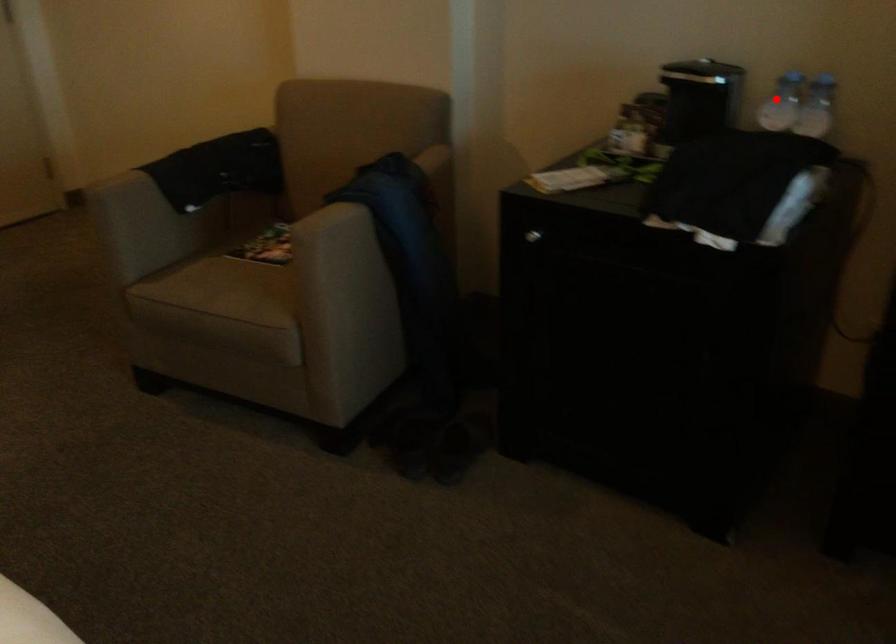
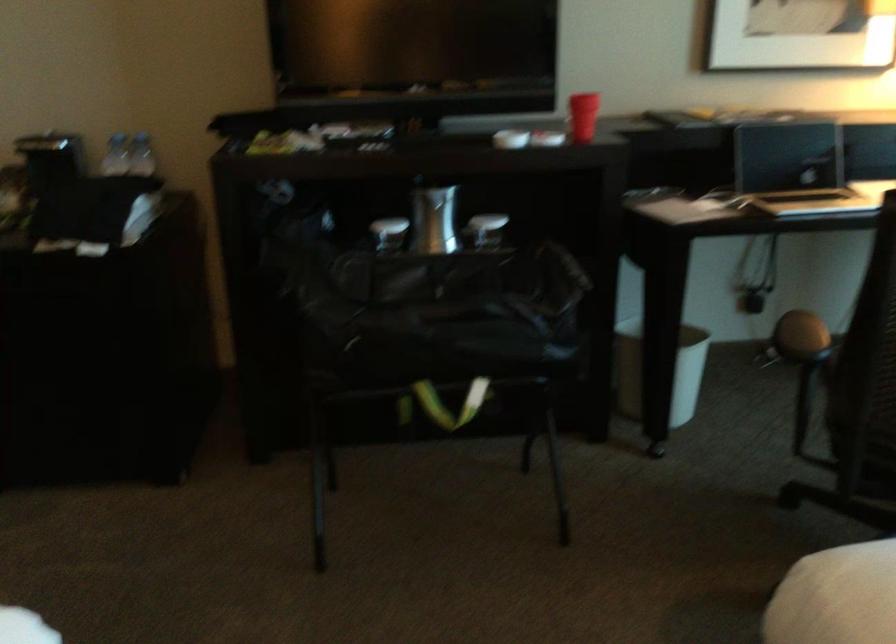
Question: I am providing you with two images of the same scene from different viewpoints. Given a red point in image1, look at the same physical point in image2. Is it:

Choices:
 (A) Closer to the viewpoint
 (B) Farther from the viewpoint

Answer: (B)